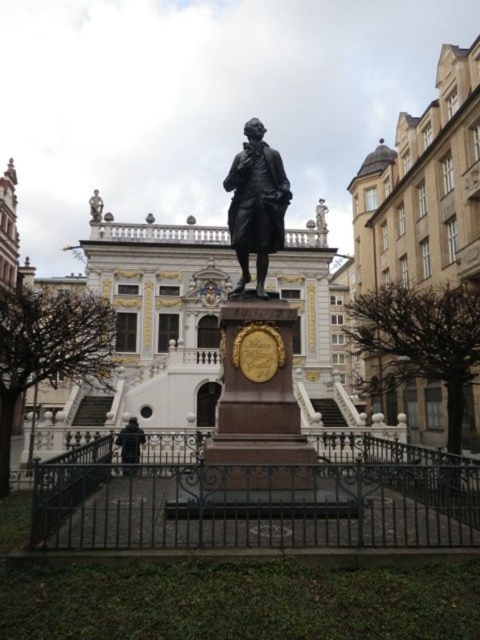
Question: Can you confirm if bronze statue at center is positioned to the left of black fabric coat at center?

Choices:
 (A) no
 (B) yes

Answer: (A)

Question: Can you confirm if bronze statue at center is positioned above black fabric coat at center?

Choices:
 (A) no
 (B) yes

Answer: (B)

Question: Based on their relative distances, which object is nearer to the brown stone palace at upper right?

Choices:
 (A) black fabric coat at center
 (B) bronze statue at center

Answer: (B)

Question: Which object is the farthest from the bronze statue at center?

Choices:
 (A) brown stone palace at upper right
 (B) black fabric coat at center

Answer: (A)

Question: Which object is positioned farthest from the brown stone palace at upper right?

Choices:
 (A) black fabric coat at center
 (B) bronze statue at center

Answer: (A)

Question: Can you confirm if brown stone palace at upper right is thinner than black fabric coat at center?

Choices:
 (A) yes
 (B) no

Answer: (B)